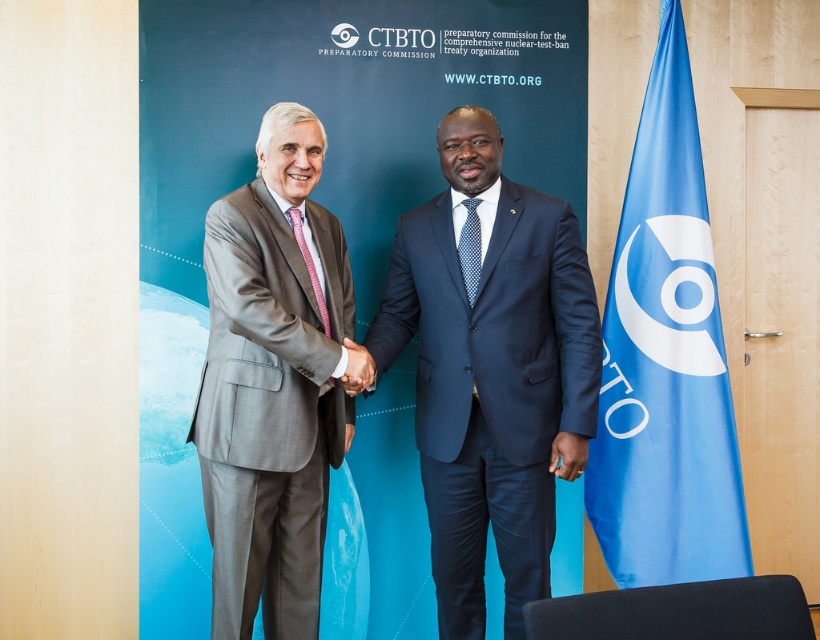
You are standing 2.27 meters away from the point at coordinates (520, 360) in the image. If you walk straight towards it, will you reach the point before the backdrop?

The point at coordinates (520, 360) is 2.27 meters away from the viewer. Since the backdrop is behind the individuals shaking hands, walking straight towards the point would require passing through the people first, so you would not reach the point before the backdrop.

You are attending a formal event where the navy blue suit at center and the blue fabric flag at right are present. If you want to take a closer look at both items, which one should you move towards first to get a better view?

You should move towards the navy blue suit at center first because it is closer to you than the blue fabric flag at right.

You are standing in front of the CTBTO backdrop and notice a specific point in the image. Can you identify which object is located at point (x=492, y=371)?

The navy blue suit at center is located at point (x=492, y=371).